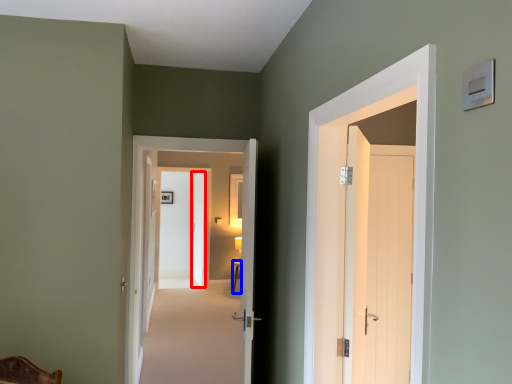
Question: Which object is further to the camera taking this photo, door (highlighted by a red box) or table (highlighted by a blue box)?

Choices:
 (A) door
 (B) table

Answer: (A)